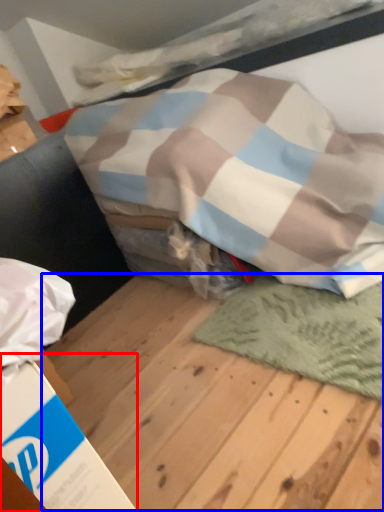
Question: Which of the following is the closest to the observer, cardboard box (highlighted by a red box) or plywood (highlighted by a blue box)?

Choices:
 (A) cardboard box
 (B) plywood

Answer: (B)